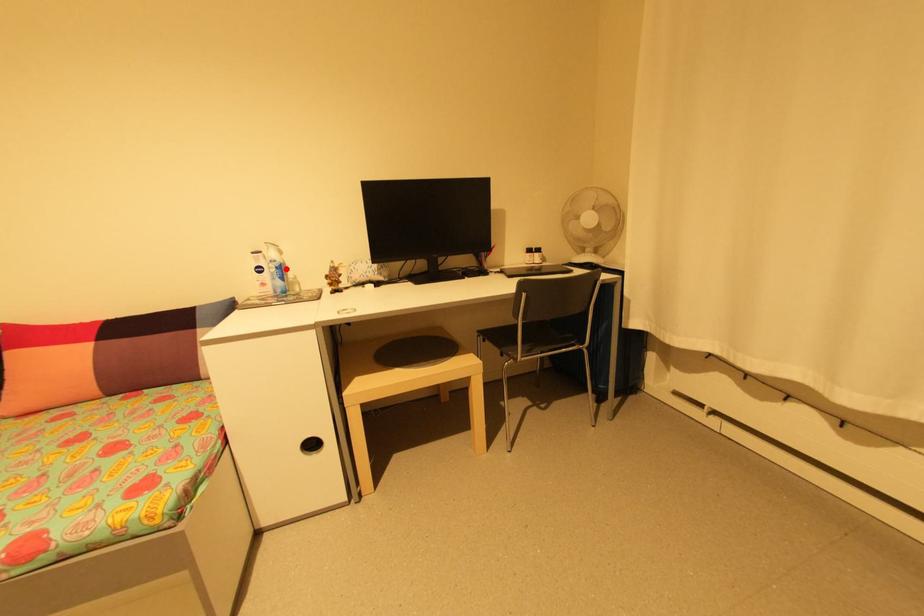
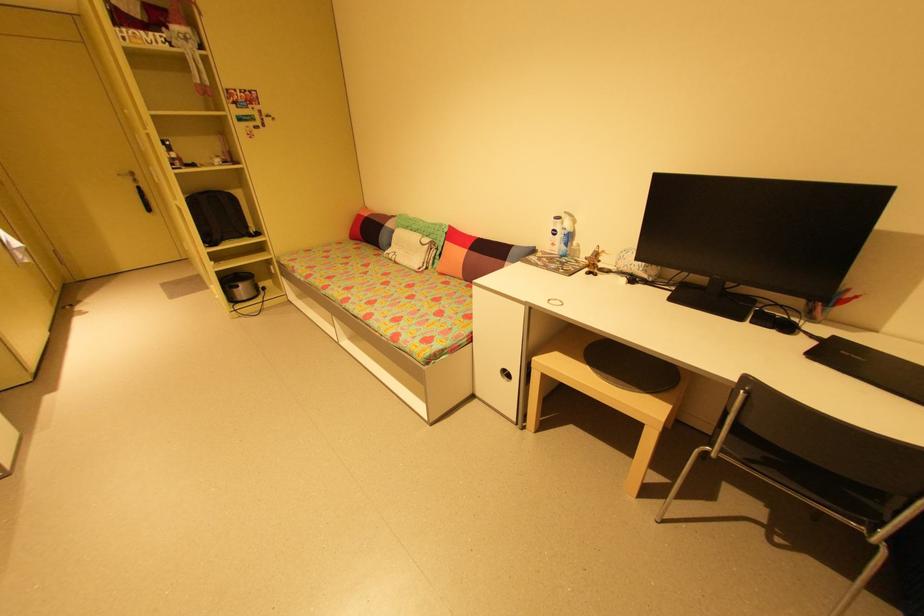
In the second image, find the point that corresponds to the highlighted location in the first image.

(574, 237)